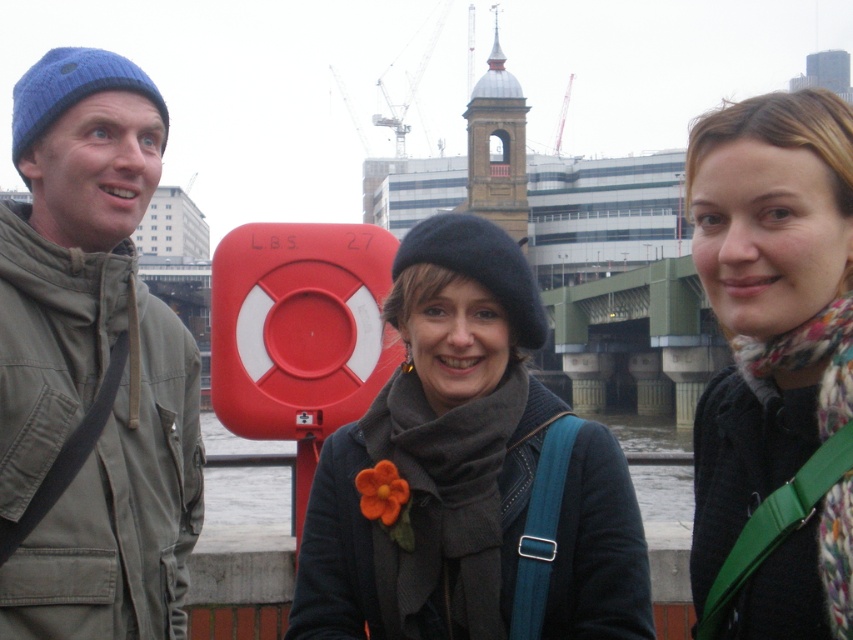
You are a fashion designer observing the knitted blue beanie at left and the floral scarf at center. Which accessory has a larger size?

The floral scarf at center is larger than the knitted blue beanie at left.

You are organizing a fashion show and need to display two scarves on a mannequin. The dark gray wool scarf at center and the floral scarf at center are both available. Which scarf should you choose if you want the one that takes up more visual space on the display?

The floral scarf at center takes up more visual space than the dark gray wool scarf at center, so it should be chosen for the display.

You are a fashion designer observing the scene. You need to decide which accessory to recommend for a cold day based on size. Which of the two items, the dark gray wool scarf at center or the knitted blue beanie at left, is more suitable for covering more of the wearer?

The knitted blue beanie at left is more suitable for covering more of the wearer since it is larger in size compared to the dark gray wool scarf at center.